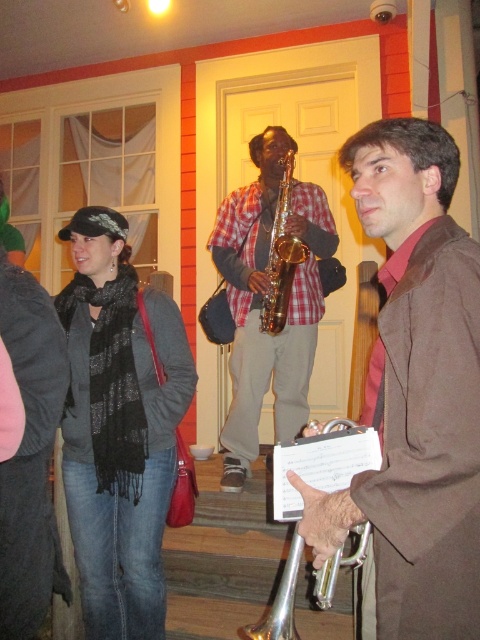
Question: Does brown leather jacket at center appear on the right side of gold shiny trumpet at center?

Choices:
 (A) no
 (B) yes

Answer: (B)

Question: Is silver/metallic trumpet at center thinner than gold shiny trumpet at center?

Choices:
 (A) no
 (B) yes

Answer: (A)

Question: Which point appears closest to the camera in this image?

Choices:
 (A) (416, 444)
 (B) (273, 204)
 (C) (315, 428)

Answer: (A)

Question: Which object is farther from the camera taking this photo?

Choices:
 (A) gold shiny trumpet at center
 (B) silver metallic trumpet at lower center
 (C) brown leather jacket at center

Answer: (A)

Question: Does black scarf at left come behind checkered fabric shirt at center?

Choices:
 (A) yes
 (B) no

Answer: (B)

Question: Estimate the real-world distances between objects in this image. Which object is farther from the black scarf at left?

Choices:
 (A) brown leather jacket at center
 (B) gold shiny trumpet at center
 (C) silver/metallic trumpet at center
 (D) silver metallic trumpet at lower center

Answer: (B)